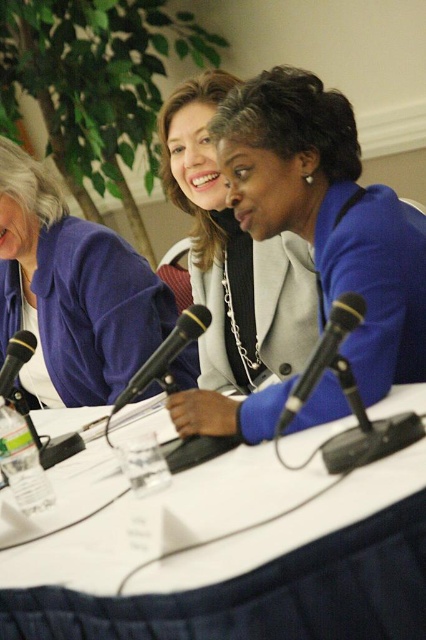
In the scene of a panel discussion, there is a black metallic microphone at center located at point (324, 353). If you were to draw a straight line from the central figure wearing a blue blazer to this microphone, would the line pass through the purple jacketed individual on the left?

The black metallic microphone at center is located at point (324, 353). The central figure in the blue blazer is seated at the table, and the purple jacketed individual is positioned to their left. Since the microphone is at the center, the line drawn from the central figure to the microphone would not pass through the purple jacketed individual who is seated to the left, so the answer is no.

You are a sound technician preparing for a panel discussion. You notice two microphones at the center of the table. The black metallic microphone at center and the black plastic microphone at center. Which one is closer to the edge of the table?

The black plastic microphone at center is closer to the edge of the table since it is positioned farther from the black metallic microphone at center which is placed centrally.

You are attending a panel discussion and need to position a microphone stand such that it is placed behind both the point at position (111, 515) and the point at position (322, 349). Is this possible given their current positions?

Point (111, 515) is behind point (322, 349), so placing the microphone stand behind both points would require it to be behind the point at (322, 349) since it is the furthest forward. However, since point (111, 515) is already behind point (322, 349), the microphone stand can be placed behind point (322, 349) and it will naturally be behind point (111, 515) as well. Therefore, it is possible to position the microphone stand behind both points by placing it behind the forwardmost point, 0.547,